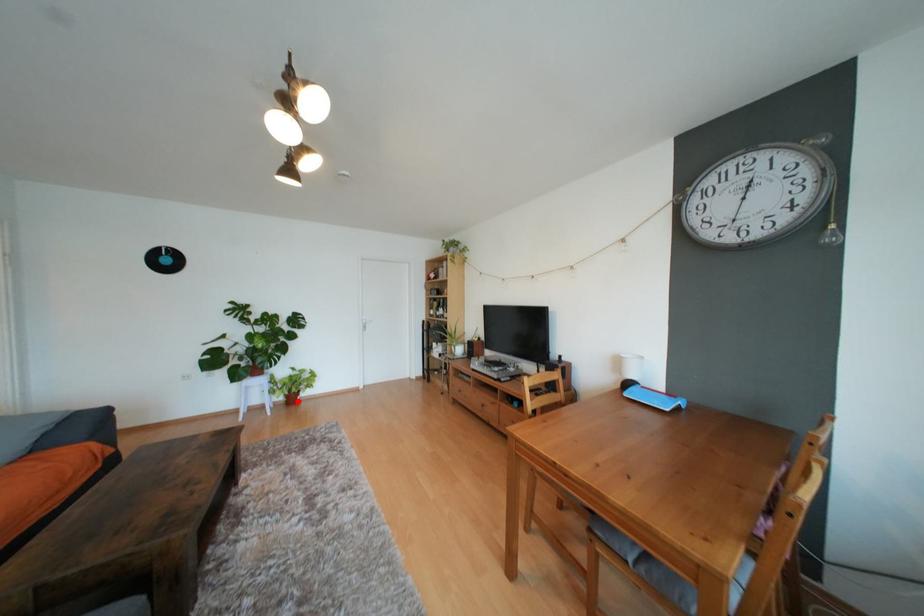
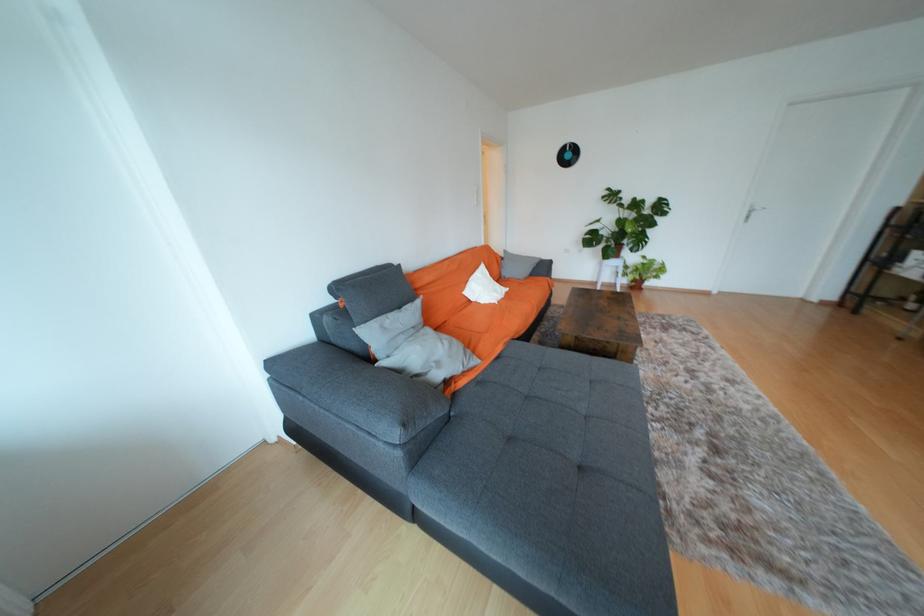
Question: I am providing you with two images of the same scene from different viewpoints. Image1 has a red point marked. In image2, the corresponding 3D location appears at what relative position? Reply with the corresponding letter.

Choices:
 (A) Closer
 (B) Farther

Answer: (A)